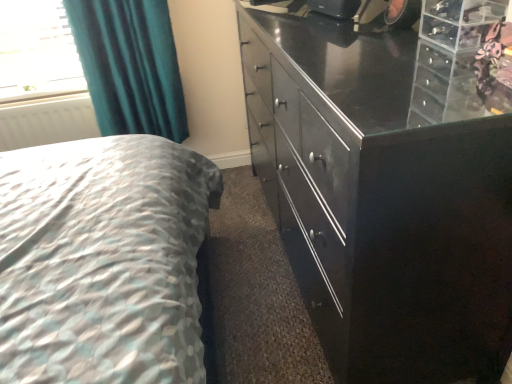
Question: Considering the relative sizes of teal fabric curtain at upper left and white matte radiator at left in the image provided, is teal fabric curtain at upper left thinner than white matte radiator at left?

Choices:
 (A) no
 (B) yes

Answer: (A)

Question: Is teal fabric curtain at upper left shorter than white matte radiator at left?

Choices:
 (A) yes
 (B) no

Answer: (B)

Question: Does teal fabric curtain at upper left have a greater height compared to white matte radiator at left?

Choices:
 (A) yes
 (B) no

Answer: (A)

Question: Does teal fabric curtain at upper left turn towards white matte radiator at left?

Choices:
 (A) no
 (B) yes

Answer: (A)

Question: Is teal fabric curtain at upper left to the right of white matte radiator at left from the viewer's perspective?

Choices:
 (A) no
 (B) yes

Answer: (B)

Question: From a real-world perspective, is teal fabric curtain at upper left positioned over white matte radiator at left based on gravity?

Choices:
 (A) no
 (B) yes

Answer: (B)

Question: Is white matte radiator at left facing away from teal fabric curtain at upper left?

Choices:
 (A) yes
 (B) no

Answer: (B)

Question: Would you consider white matte radiator at left to be distant from teal fabric curtain at upper left?

Choices:
 (A) no
 (B) yes

Answer: (A)

Question: Does white matte radiator at left come in front of teal fabric curtain at upper left?

Choices:
 (A) yes
 (B) no

Answer: (B)

Question: Could you tell me if white matte radiator at left is facing teal fabric curtain at upper left?

Choices:
 (A) yes
 (B) no

Answer: (B)

Question: Would you say white matte radiator at left is outside teal fabric curtain at upper left?

Choices:
 (A) yes
 (B) no

Answer: (A)

Question: Is the surface of white matte radiator at left in direct contact with teal fabric curtain at upper left?

Choices:
 (A) yes
 (B) no

Answer: (B)

Question: Is glossy black cabinet at right looking in the opposite direction of teal fabric curtain at upper left?

Choices:
 (A) no
 (B) yes

Answer: (A)